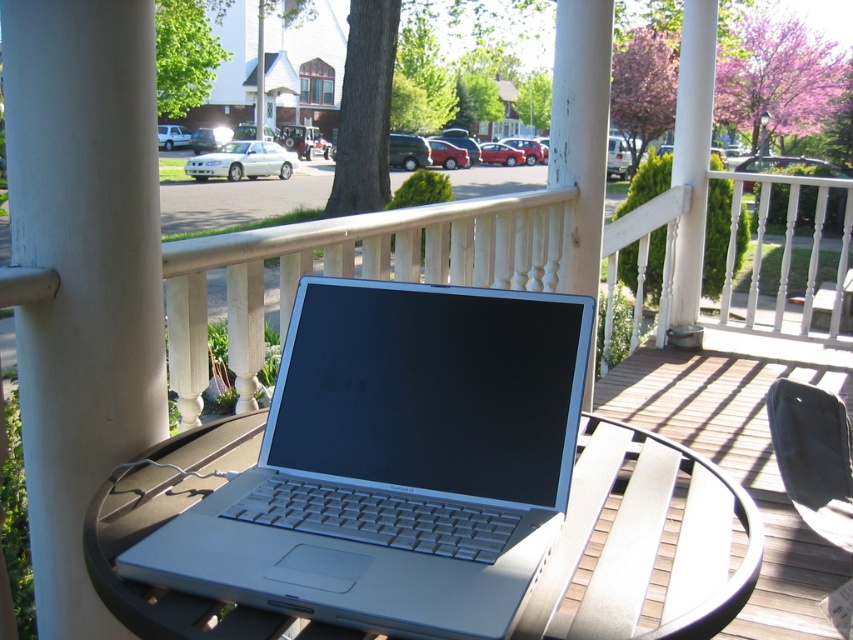
Question: Can you confirm if silver metallic laptop at center is bigger than white painted wood at center?

Choices:
 (A) yes
 (B) no

Answer: (A)

Question: Which of these objects is positioned farthest from the silver metallic laptop at center?

Choices:
 (A) black fabric bag at lower right
 (B) white painted wood at center
 (C) brown wooden deck at center

Answer: (C)

Question: Is silver metallic laptop at center above brown wooden deck at center?

Choices:
 (A) yes
 (B) no

Answer: (A)

Question: Which point appears closest to the camera in this image?

Choices:
 (A) (828, 406)
 (B) (347, 612)

Answer: (B)

Question: Which is nearer to the black fabric bag at lower right?

Choices:
 (A) white painted wood at center
 (B) brown wooden deck at center
 (C) silver metallic laptop at center

Answer: (B)

Question: Considering the relative positions of brown wooden deck at center and black fabric bag at lower right in the image provided, where is brown wooden deck at center located with respect to black fabric bag at lower right?

Choices:
 (A) right
 (B) left

Answer: (A)